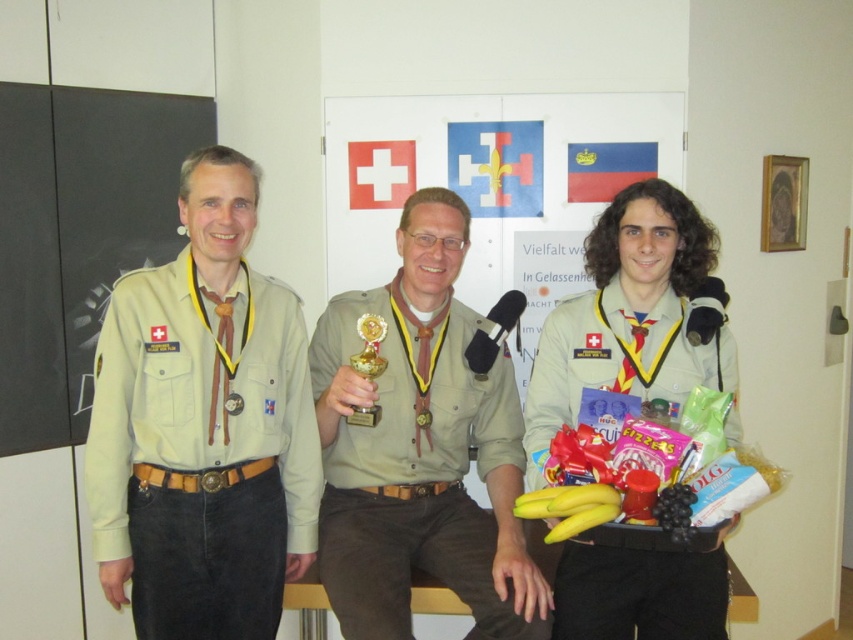
In the image of the scout ceremony, there are two scouts wearing beige uniform at left and khaki uniform at center. Which scout is positioned to the left side of the other?

The beige uniform at left is positioned to the left of the khaki uniform at center.

You are organizing a scout event and need to place the beige uniform at left and the gold metallic trophy at center on a shelf. If the shelf has limited space, which item should you place first to ensure both fit?

The beige uniform at left is larger in size than the gold metallic trophy at center, so you should place the beige uniform at left first to accommodate its larger size before placing the gold metallic trophy at center.